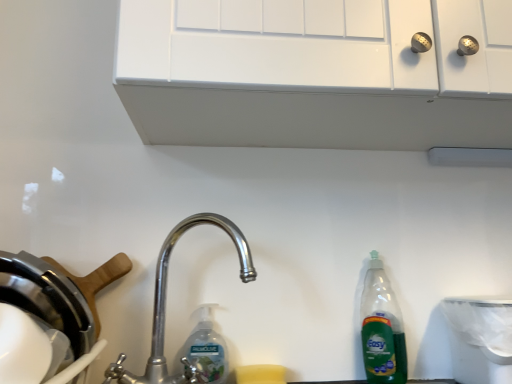
What is the approximate width of polished metal faucet at center?

22.27 centimeters.

What is the approximate width of white matte cabinet at upper center?

The width of white matte cabinet at upper center is 37.10 centimeters.

Locate an element on the screen. white matte cabinet at upper center is located at coordinates (310, 78).

I want to click on white plastic trash can at lower right, so click(480, 338).

Visually, is polished metal faucet at center positioned to the left or to the right of white plastic trash can at lower right?

polished metal faucet at center is to the left of white plastic trash can at lower right.

Is polished metal faucet at center taller than white plastic trash can at lower right?

Yes, polished metal faucet at center is taller than white plastic trash can at lower right.

Is polished metal faucet at center with white plastic trash can at lower right?

No.

Is polished metal faucet at center positioned with its back to white plastic trash can at lower right?

No, polished metal faucet at center is not facing the opposite direction of white plastic trash can at lower right.

From the picture: Which is in front, clear plastic bottle at center or white plastic trash can at lower right?

white plastic trash can at lower right is more forward.

Considering the sizes of clear plastic bottle at center and white plastic trash can at lower right in the image, is clear plastic bottle at center wider or thinner than white plastic trash can at lower right?

In the image, clear plastic bottle at center appears to be more narrow than white plastic trash can at lower right.

Looking at the image, does clear plastic bottle at center seem bigger or smaller compared to white plastic trash can at lower right?

In the image, clear plastic bottle at center appears to be smaller than white plastic trash can at lower right.

From a real-world perspective, is clear plastic bottle at center located higher than white plastic trash can at lower right?

No, from a real-world perspective, clear plastic bottle at center is not over white plastic trash can at lower right

From the image's perspective, relative to green plastic bottle at right, is clear plastic bottle at center above or below?

Clearly, from the image's perspective, clear plastic bottle at center is below green plastic bottle at right.

Looking at this image, is clear plastic bottle at center positioned with its back to green plastic bottle at right?

No, clear plastic bottle at center is not facing away from green plastic bottle at right.

I want to click on bottle above the clear plastic bottle at center (from the image's perspective), so click(x=382, y=329).

Looking at their sizes, would you say clear plastic bottle at center is wider or thinner than green plastic bottle at right?

clear plastic bottle at center is thinner than green plastic bottle at right.

From a real-world perspective, is white plastic trash can at lower right below green plastic bottle at right?

Yes, from a real-world perspective, white plastic trash can at lower right is beneath green plastic bottle at right.

How far apart are white plastic trash can at lower right and green plastic bottle at right?

5.68 inches.

Find the location of a particular element. appliance in front of the green plastic bottle at right is located at coordinates (480, 338).

Can you confirm if white plastic trash can at lower right is bigger than green plastic bottle at right?

Indeed, white plastic trash can at lower right has a larger size compared to green plastic bottle at right.

Would you consider white matte cabinet at upper center to be distant from clear plastic bottle at center?

No, white matte cabinet at upper center is in close proximity to clear plastic bottle at center.

Between white matte cabinet at upper center and clear plastic bottle at center, which one has less height?

clear plastic bottle at center.

Can we say white matte cabinet at upper center lies outside clear plastic bottle at center?

white matte cabinet at upper center is positioned outside clear plastic bottle at center.

Is the position of white matte cabinet at upper center more distant than that of clear plastic bottle at center?

No, it is not.

Is clear plastic bottle at center to the right of polished metal faucet at center from the viewer's perspective?

Indeed, clear plastic bottle at center is positioned on the right side of polished metal faucet at center.

Is clear plastic bottle at center directly adjacent to polished metal faucet at center?

Yes, clear plastic bottle at center is next to polished metal faucet at center.

From a real-world perspective, is clear plastic bottle at center above or below polished metal faucet at center?

Clearly, from a real-world perspective, clear plastic bottle at center is below polished metal faucet at center.

From their relative heights in the image, would you say green plastic bottle at right is taller or shorter than white plastic trash can at lower right?

green plastic bottle at right is taller than white plastic trash can at lower right.

Considering the relative positions of green plastic bottle at right and white plastic trash can at lower right in the image provided, is green plastic bottle at right to the left of white plastic trash can at lower right from the viewer's perspective?

Yes.

From the image's perspective, relative to white plastic trash can at lower right, is green plastic bottle at right above or below?

From the image's perspective, green plastic bottle at right appears above white plastic trash can at lower right.

Is green plastic bottle at right completely or partially outside of white plastic trash can at lower right?

That's correct, green plastic bottle at right is outside of white plastic trash can at lower right.

This screenshot has height=384, width=512. I want to click on tap on the left side of white plastic trash can at lower right, so click(165, 305).

Where is `appliance lying above the clear plastic bottle at center (from the image's perspective)`? This screenshot has height=384, width=512. appliance lying above the clear plastic bottle at center (from the image's perspective) is located at coordinates (480, 338).

Based on their spatial positions, is polished metal faucet at center or white plastic trash can at lower right closer to clear plastic bottle at center?

Based on the image, polished metal faucet at center appears to be nearer to clear plastic bottle at center.

From the image, which object appears to be nearer to green plastic bottle at right, white plastic trash can at lower right or white matte cabinet at upper center?

white plastic trash can at lower right is closer to green plastic bottle at right.

Which object lies nearer to the anchor point clear plastic bottle at center, polished metal faucet at center or green plastic bottle at right?

Based on the image, polished metal faucet at center appears to be nearer to clear plastic bottle at center.

Based on the photo, based on their spatial positions, is white matte cabinet at upper center or white plastic trash can at lower right closer to clear plastic bottle at center?

white plastic trash can at lower right.

Looking at the image, which one is located further to white matte cabinet at upper center, polished metal faucet at center or white plastic trash can at lower right?

white plastic trash can at lower right is positioned further to the anchor white matte cabinet at upper center.

Looking at this image, which object lies further to the anchor point white plastic trash can at lower right, clear plastic bottle at center or green plastic bottle at right?

The object further to white plastic trash can at lower right is clear plastic bottle at center.

Looking at the image, which one is located closer to clear plastic bottle at center, polished metal faucet at center or white matte cabinet at upper center?

polished metal faucet at center is positioned closer to the anchor clear plastic bottle at center.

Considering their positions, is clear plastic bottle at center positioned closer to white plastic trash can at lower right than white matte cabinet at upper center?

clear plastic bottle at center is positioned closer to the anchor white plastic trash can at lower right.

Where is `bottle that lies between white matte cabinet at upper center and clear plastic bottle at center from top to bottom`? bottle that lies between white matte cabinet at upper center and clear plastic bottle at center from top to bottom is located at coordinates (382, 329).

In order to click on bottle that lies between white matte cabinet at upper center and white plastic trash can at lower right from top to bottom in this screenshot , I will do `click(382, 329)`.

Where is `cleaning product between polished metal faucet at center and white plastic trash can at lower right in the horizontal direction`? Image resolution: width=512 pixels, height=384 pixels. cleaning product between polished metal faucet at center and white plastic trash can at lower right in the horizontal direction is located at coordinates (207, 349).

This screenshot has height=384, width=512. Identify the location of tap that lies between white matte cabinet at upper center and green plastic bottle at right from top to bottom. (165, 305).